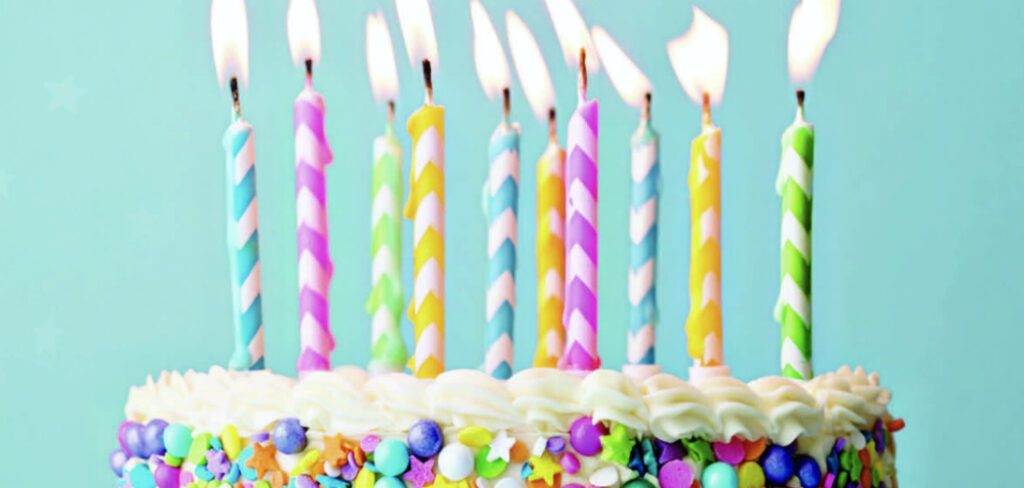
The width and height of the screenshot is (1024, 488). What are the coordinates of `candle wick` in the screenshot? It's located at (234, 98), (309, 72), (390, 118), (426, 80), (505, 113), (550, 130), (581, 91), (640, 115), (708, 115), (801, 107).